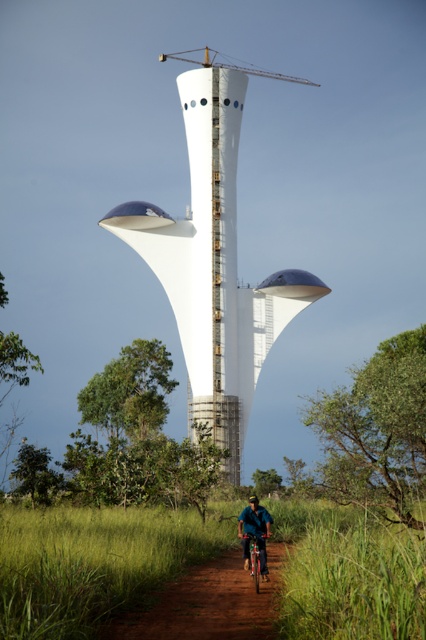
Who is more distant from viewer, (278,566) or (310,81)?

Positioned behind is point (310,81).

At what (x,y) coordinates should I click in order to perform the action: click on brown dirt track at center. Please return your answer as a coordinate pair (x, y). This screenshot has width=426, height=640. Looking at the image, I should click on (207, 604).

Can you confirm if white smooth tower at center is bigger than metallic gray crane at upper center?

Correct, white smooth tower at center is larger in size than metallic gray crane at upper center.

The image size is (426, 640). What do you see at coordinates (213, 264) in the screenshot?
I see `white smooth tower at center` at bounding box center [213, 264].

At what (x,y) coordinates should I click in order to perform the action: click on white smooth tower at center. Please return your answer as a coordinate pair (x, y). The height and width of the screenshot is (640, 426). Looking at the image, I should click on (213, 264).

Does white smooth tower at center have a greater width compared to metallic silver bicycle at center?

Indeed, white smooth tower at center has a greater width compared to metallic silver bicycle at center.

Is point (224, 116) farther from camera compared to point (256, 586)?

Yes, point (224, 116) is farther from viewer.

Identify the location of white smooth tower at center. This screenshot has height=640, width=426. (213, 264).